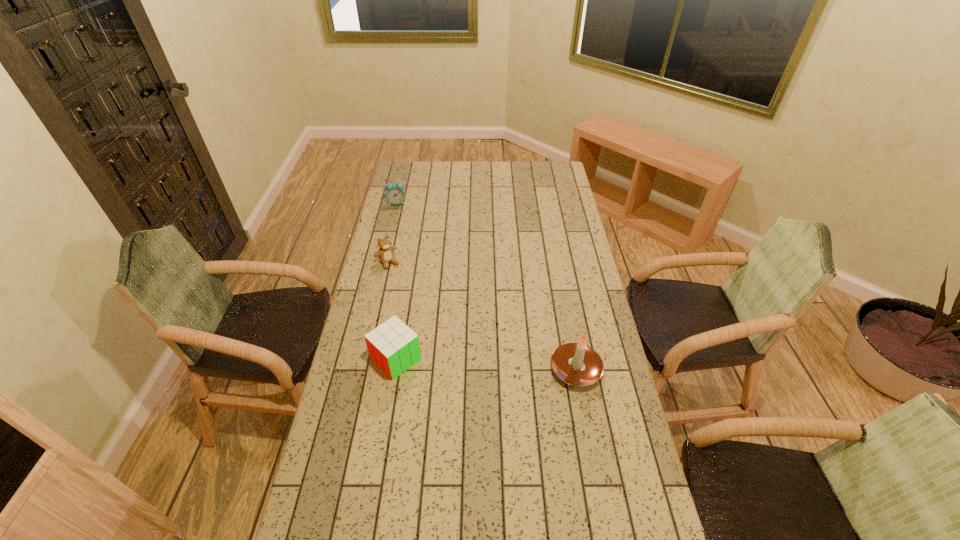
Where is `free area in between the teddy bear and the cube`? The width and height of the screenshot is (960, 540). free area in between the teddy bear and the cube is located at coordinates (392, 310).

In order to click on free space between the second farthest object and the candle in this screenshot , I will do `click(482, 316)`.

Where is `object that can be found as the second closest to the tallest object`? This screenshot has width=960, height=540. object that can be found as the second closest to the tallest object is located at coordinates (385, 253).

I want to click on the second closest object to the cube, so click(x=576, y=364).

This screenshot has width=960, height=540. I want to click on free space that satisfies the following two spatial constraints: 1. on the front side of the rightmost object; 2. on the left side of the third nearest object, so click(364, 369).